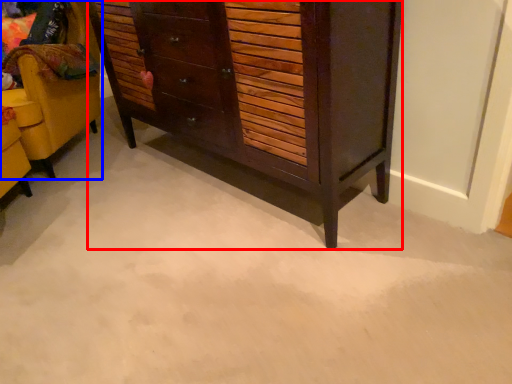
Question: Which of the following is the farthest to the observer, chest of drawers (highlighted by a red box) or furniture (highlighted by a blue box)?

Choices:
 (A) chest of drawers
 (B) furniture

Answer: (B)